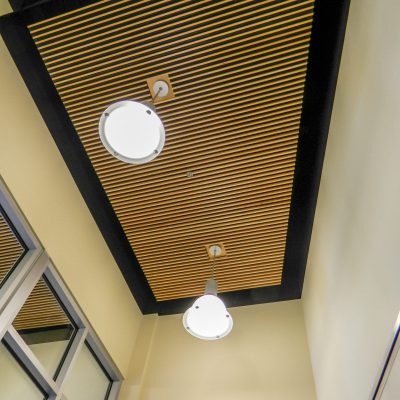
At what (x,y) coordinates should I click in order to perform the action: click on ceiling. Please return your answer as a coordinate pair (x, y). The image size is (400, 400). Looking at the image, I should click on (193, 168).